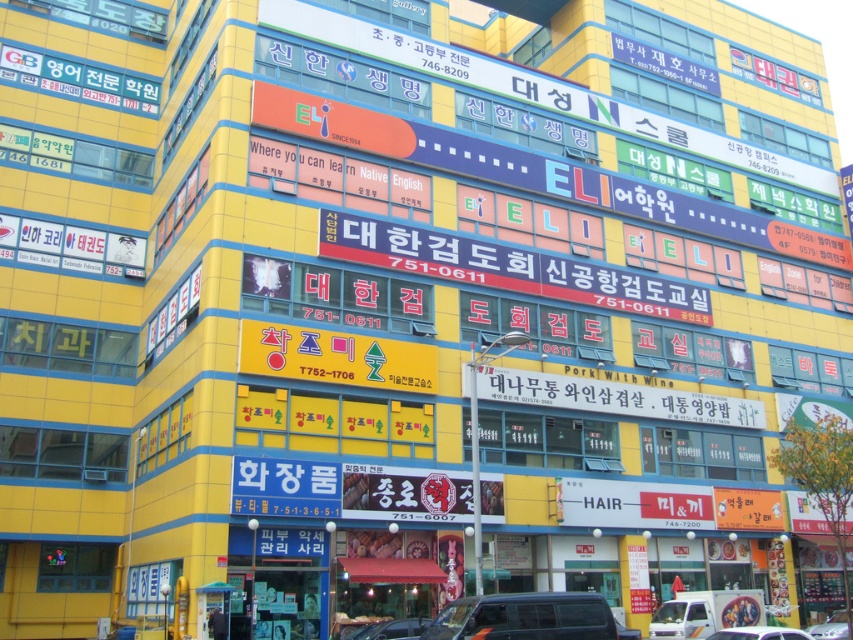
Consider the image. Between dark gray metallic van at center and white matte car at lower center, which one is positioned lower?

white matte car at lower center is below.

Is dark gray metallic van at center further to the viewer compared to white matte car at lower center?

Yes.

This screenshot has height=640, width=853. Describe the element at coordinates (525, 618) in the screenshot. I see `dark gray metallic van at center` at that location.

Where is `dark gray metallic van at center`? dark gray metallic van at center is located at coordinates point(525,618).

Who is more distant from viewer, (547, 593) or (383, 627)?

The point (547, 593) is behind.

Who is more forward, (578,608) or (399,618)?

Point (578,608)

Where is `dark gray metallic van at center`? dark gray metallic van at center is located at coordinates (525, 618).

Who is lower down, dark gray metallic van at center or shiny silver car at center?

shiny silver car at center is lower down.

Measure the distance between dark gray metallic van at center and shiny silver car at center.

dark gray metallic van at center and shiny silver car at center are 22.55 meters apart.

At what (x,y) coordinates should I click in order to perform the action: click on dark gray metallic van at center. Please return your answer as a coordinate pair (x, y). This screenshot has width=853, height=640. Looking at the image, I should click on (525, 618).